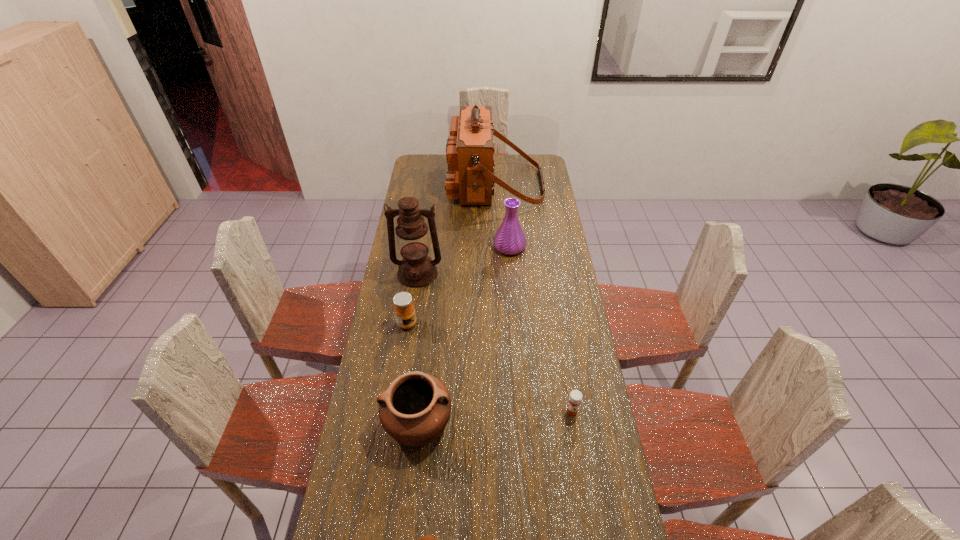
Where is `object that is the sixth closest to the fourth shortest object`? This screenshot has height=540, width=960. object that is the sixth closest to the fourth shortest object is located at coordinates coord(470,177).

Select which object appears as the third closest to the vase. Please provide its 2D coordinates. Your answer should be formatted as a tuple, i.e. [(x, y)], where the tuple contains the x and y coordinates of a point satisfying the conditions above.

[(404, 310)]

Where is `vacant space that satisfies the following two spatial constraints: 1. on the face side of the third tallest object; 2. on the right side of the farthest object`? vacant space that satisfies the following two spatial constraints: 1. on the face side of the third tallest object; 2. on the right side of the farthest object is located at coordinates (498, 247).

Identify the location of free location that satisfies the following two spatial constraints: 1. on the face side of the satchel; 2. on the front side of the fourth shortest object. This screenshot has height=540, width=960. (506, 422).

You are a GUI agent. You are given a task and a screenshot of the screen. Output one action in this format:
    pyautogui.click(x=<x>, y=<y>)
    Task: Click on the vacant space that satisfies the following two spatial constraints: 1. on the front side of the oil lamp; 2. on the front-facing side of the fourth nearest object
    
    Given the screenshot: What is the action you would take?
    pyautogui.click(x=410, y=324)

The image size is (960, 540). Find the location of `vacant region that satisfies the following two spatial constraints: 1. on the back side of the oil lamp; 2. on the left side of the third tallest object`. vacant region that satisfies the following two spatial constraints: 1. on the back side of the oil lamp; 2. on the left side of the third tallest object is located at coordinates pos(421,247).